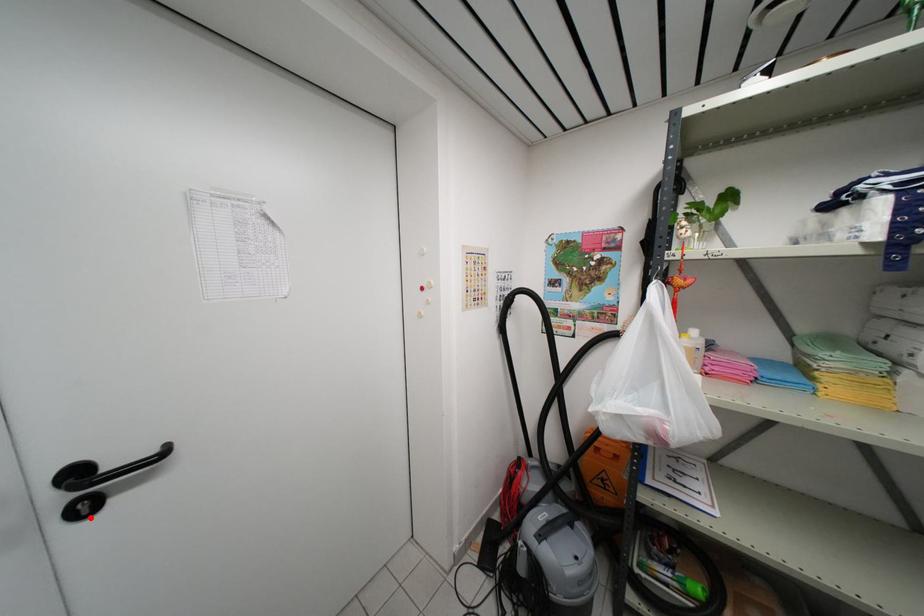
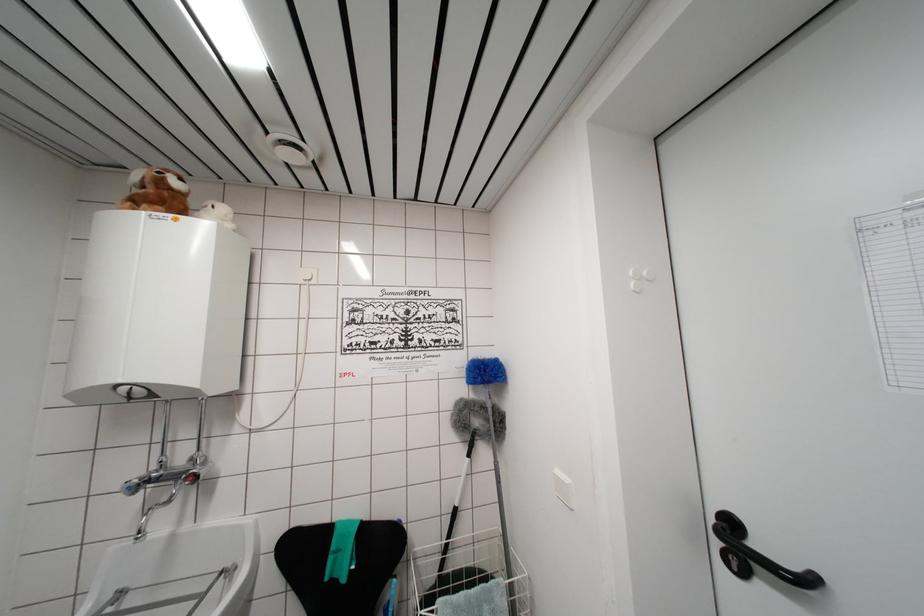
Locate, in the second image, the point that corresponds to the highlighted location in the first image.

(738, 573)